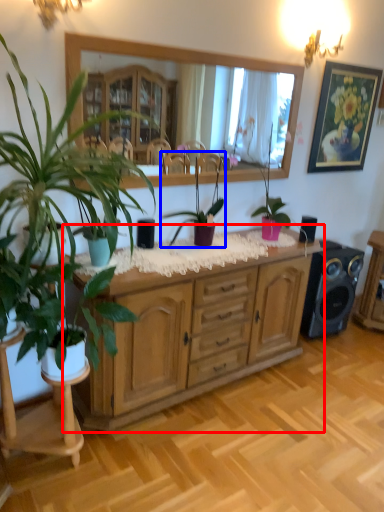
Question: Which point is further to the camera, cabinetry (highlighted by a red box) or houseplant (highlighted by a blue box)?

Choices:
 (A) cabinetry
 (B) houseplant

Answer: (B)